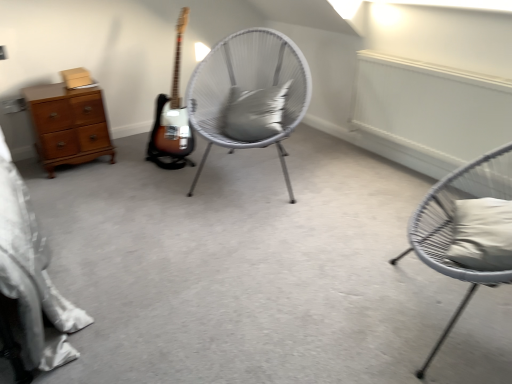
Question: From a real-world perspective, is white wicker chair at center, which ranks as the first chair in left-to-right order, positioned above or below matte gray chair at right, the 1th chair viewed from the front?

Choices:
 (A) below
 (B) above

Answer: (B)

Question: Is white wicker chair at center, positioned as the 2th chair in front-to-back order, bigger or smaller than matte gray chair at right, the 1th chair viewed from the front?

Choices:
 (A) big
 (B) small

Answer: (A)

Question: Which object is positioned closest to the gray matte pillow at center, which is the 1th pillow from left to right?

Choices:
 (A) matte gray chair at right, which is the 2th chair in left-to-right order
 (B) white fabric pillow at right, the first pillow in the bottom-to-top sequence
 (C) wooden chest of drawers at left
 (D) white wicker chair at center, which ranks as the first chair in left-to-right order

Answer: (D)

Question: Which of these objects is positioned closest to the white wicker chair at center, positioned as the 2th chair in front-to-back order?

Choices:
 (A) matte gray chair at right, the 2th chair viewed from the back
 (B) white fabric pillow at right, which ranks as the 1th pillow in right-to-left order
 (C) gray matte pillow at center, which is counted as the 1th pillow, starting from the top
 (D) wooden chest of drawers at left

Answer: (C)